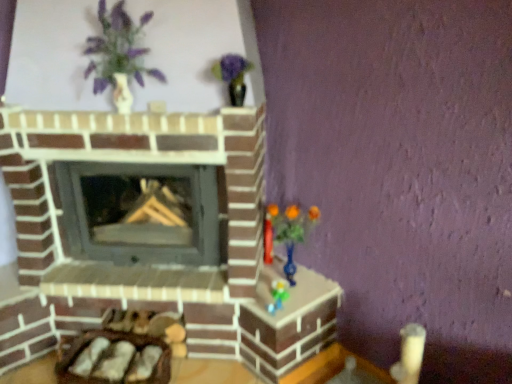
Question: Can you confirm if smooth gray wood burning stove at center is wider than matte white vase at upper left?

Choices:
 (A) no
 (B) yes

Answer: (B)

Question: Is smooth gray wood burning stove at center closer to camera compared to matte white vase at upper left?

Choices:
 (A) no
 (B) yes

Answer: (A)

Question: Is smooth gray wood burning stove at center outside of matte white vase at upper left?

Choices:
 (A) yes
 (B) no

Answer: (A)

Question: Does smooth gray wood burning stove at center turn towards matte white vase at upper left?

Choices:
 (A) yes
 (B) no

Answer: (B)

Question: Is smooth gray wood burning stove at center thinner than matte white vase at upper left?

Choices:
 (A) no
 (B) yes

Answer: (A)

Question: From the image's perspective, is translucent blue vase at right located above or below smooth gray wood burning stove at center?

Choices:
 (A) above
 (B) below

Answer: (B)

Question: Which is correct: translucent blue vase at right is inside smooth gray wood burning stove at center, or outside of it?

Choices:
 (A) inside
 (B) outside

Answer: (B)

Question: From a real-world perspective, is translucent blue vase at right physically located above or below smooth gray wood burning stove at center?

Choices:
 (A) below
 (B) above

Answer: (A)

Question: In terms of height, does translucent blue vase at right look taller or shorter compared to smooth gray wood burning stove at center?

Choices:
 (A) short
 (B) tall

Answer: (A)

Question: Choose the correct answer: Is smooth gray wood burning stove at center inside translucent blue vase at right or outside it?

Choices:
 (A) inside
 (B) outside

Answer: (B)

Question: Is smooth gray wood burning stove at center bigger or smaller than translucent blue vase at right?

Choices:
 (A) big
 (B) small

Answer: (A)

Question: From a real-world perspective, is smooth gray wood burning stove at center physically located above or below translucent blue vase at right?

Choices:
 (A) below
 (B) above

Answer: (B)

Question: Looking at their shapes, would you say smooth gray wood burning stove at center is wider or thinner than translucent blue vase at right?

Choices:
 (A) thin
 (B) wide

Answer: (B)

Question: Is translucent blue vase at right bigger or smaller than matte white vase at upper left?

Choices:
 (A) small
 (B) big

Answer: (A)

Question: In terms of height, does translucent blue vase at right look taller or shorter compared to matte white vase at upper left?

Choices:
 (A) short
 (B) tall

Answer: (A)